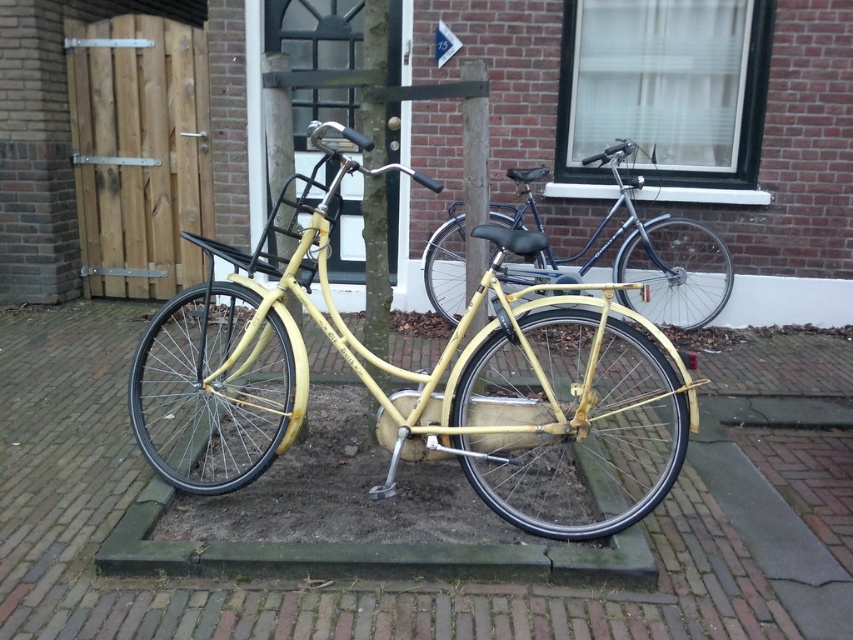
You are standing in front of two bicycles parked in front of a brick building. You notice two points marked on the image. One is at point (144, 147) and the other is at point (612, 276). Which point is closer to you?

Point (144, 147) is closer to you because it is further to the viewer than point (612, 276).

You are a delivery person who needs to quickly access your bike. You see the yellow matte bicycle at center and the matte blue bicycle at center. Which one is closer to the left side of the path?

The yellow matte bicycle at center is positioned on the left side of the matte blue bicycle at center, so it is closer to the left side of the path.